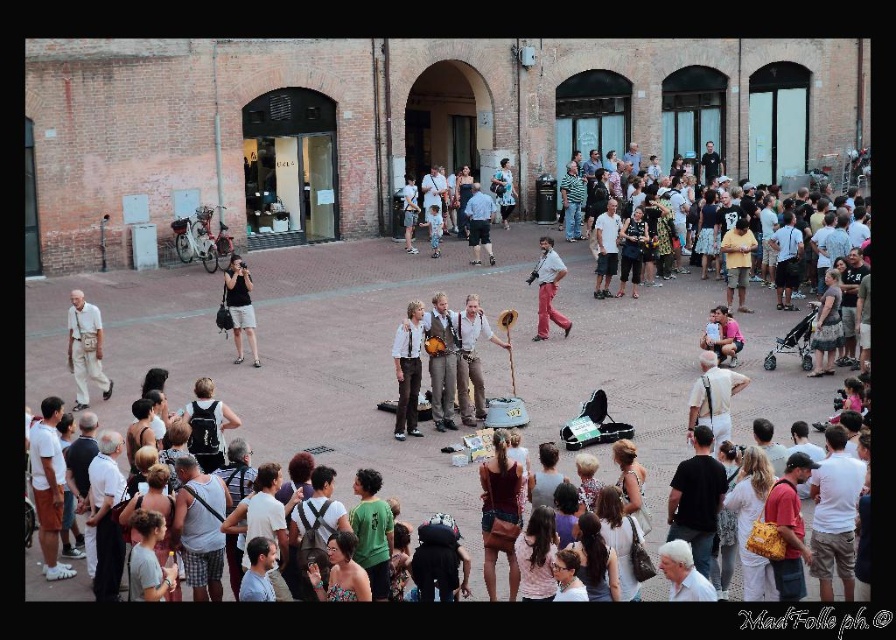
Which is above, matte brown vest at center or matte black camera at center?

matte black camera at center is higher up.

Between matte brown vest at center and matte black camera at center, which one is positioned lower?

matte brown vest at center is lower down.

Describe the element at coordinates (471, 358) in the screenshot. Image resolution: width=896 pixels, height=640 pixels. I see `matte brown vest at center` at that location.

At what (x,y) coordinates should I click in order to perform the action: click on matte brown vest at center. Please return your answer as a coordinate pair (x, y). The width and height of the screenshot is (896, 640). Looking at the image, I should click on (471, 358).

Is light brown leather jacket at center below light blue denim shorts at center?

Indeed, light brown leather jacket at center is positioned under light blue denim shorts at center.

Does light brown leather jacket at center appear on the left side of light blue denim shorts at center?

Yes, light brown leather jacket at center is to the left of light blue denim shorts at center.

Is point (401, 352) positioned before point (487, 248)?

Yes, point (401, 352) is in front of point (487, 248).

This screenshot has height=640, width=896. Identify the location of light brown leather jacket at center. (408, 369).

Who is more forward, (x=481, y=378) or (x=478, y=241)?

Positioned in front is point (x=481, y=378).

Is matte brown vest at center to the left of light blue denim shorts at center from the viewer's perspective?

Correct, you'll find matte brown vest at center to the left of light blue denim shorts at center.

Where is `matte brown vest at center`? This screenshot has height=640, width=896. matte brown vest at center is located at coordinates (471, 358).

Find the location of a particular element. The width and height of the screenshot is (896, 640). matte brown vest at center is located at coordinates (471, 358).